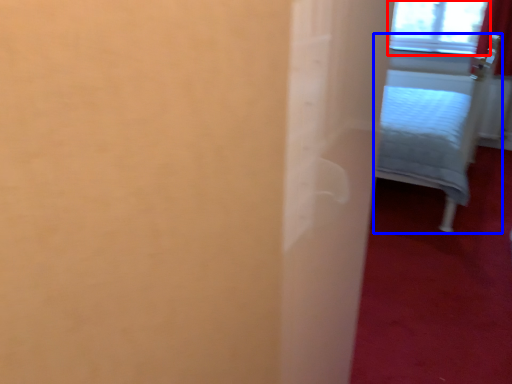
Question: Which object is further to the camera taking this photo, window (highlighted by a red box) or furniture (highlighted by a blue box)?

Choices:
 (A) window
 (B) furniture

Answer: (A)